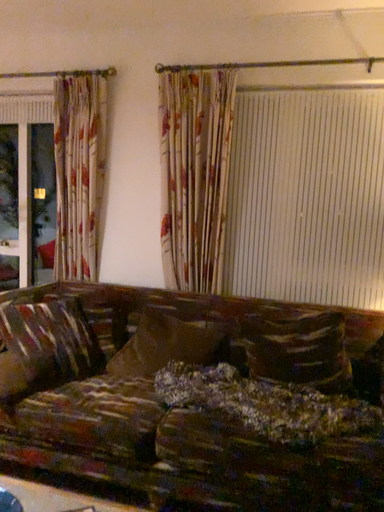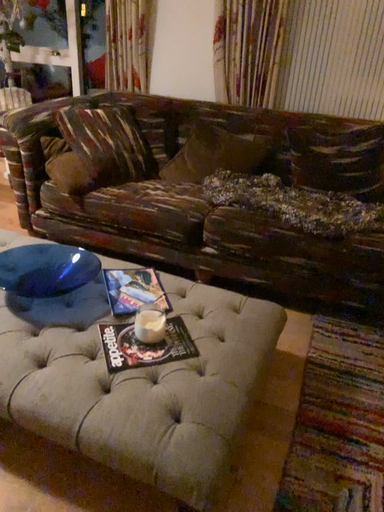
Question: Which way did the camera rotate in the video?

Choices:
 (A) rotated downward
 (B) rotated upward

Answer: (A)